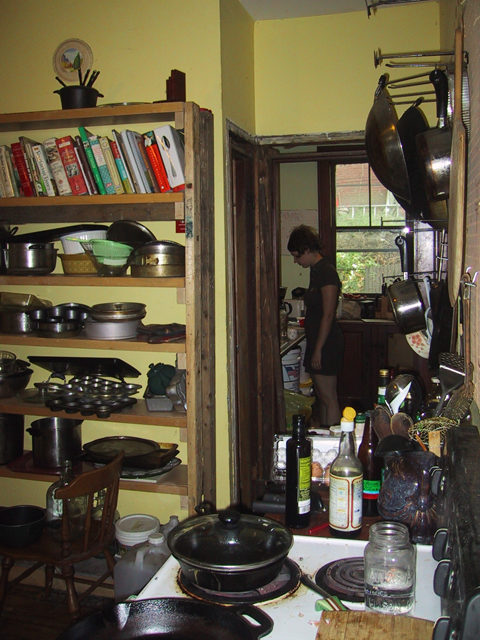
Identify the location of bottle. This screenshot has height=640, width=480. (352, 488), (303, 470).